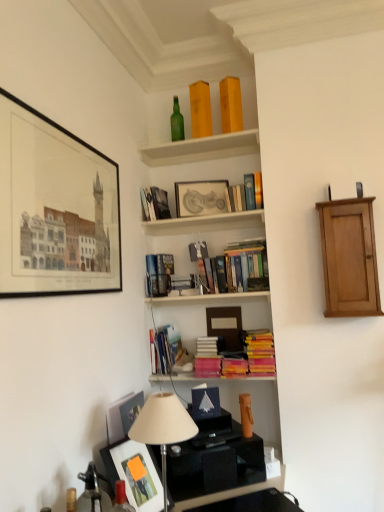
This screenshot has height=512, width=384. I want to click on free point to the right of green glass bottle at upper center, so click(200, 147).